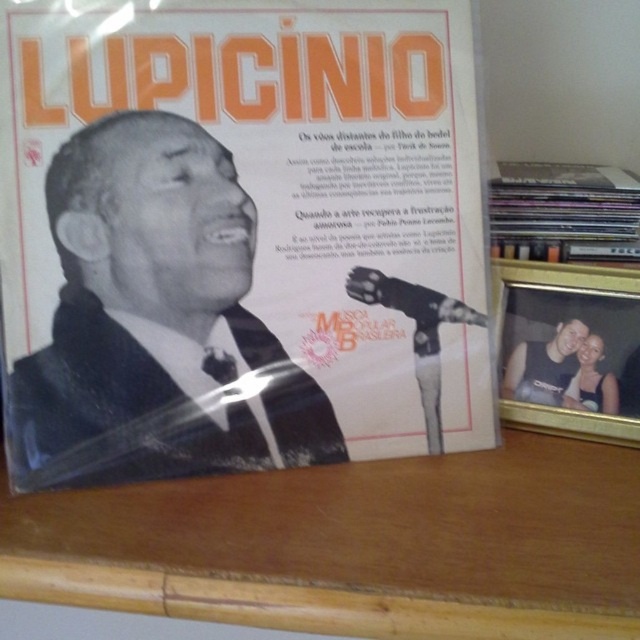
Where is `matte black vinyl records at upper right`? This screenshot has width=640, height=640. matte black vinyl records at upper right is located at coordinates (563, 212).

Identify the location of matte black vinyl records at upper right. This screenshot has width=640, height=640. (563, 212).

Identify the location of matte black vinyl records at upper right. This screenshot has height=640, width=640. (563, 212).

Is point (92, 461) farther from camera compared to point (570, 195)?

That is False.

Does matte black suit at center have a lesser width compared to matte black vinyl records at upper right?

No, matte black suit at center is not thinner than matte black vinyl records at upper right.

Does point (104, 470) come behind point (627, 244)?

No, (104, 470) is in front of (627, 244).

The image size is (640, 640). In order to click on matte black suit at center in this screenshot , I will do [x=156, y=321].

Can you confirm if matte black suit at center is taller than matte black tank top at lower right?

Yes, matte black suit at center is taller than matte black tank top at lower right.

How distant is matte black suit at center from matte black tank top at lower right?

matte black suit at center and matte black tank top at lower right are 31.16 centimeters apart from each other.

Is point (269, 422) closer to viewer compared to point (516, 392)?

Yes, it is.

At what (x,y) coordinates should I click in order to perform the action: click on matte black suit at center. Please return your answer as a coordinate pair (x, y). The width and height of the screenshot is (640, 640). Looking at the image, I should click on (156, 321).